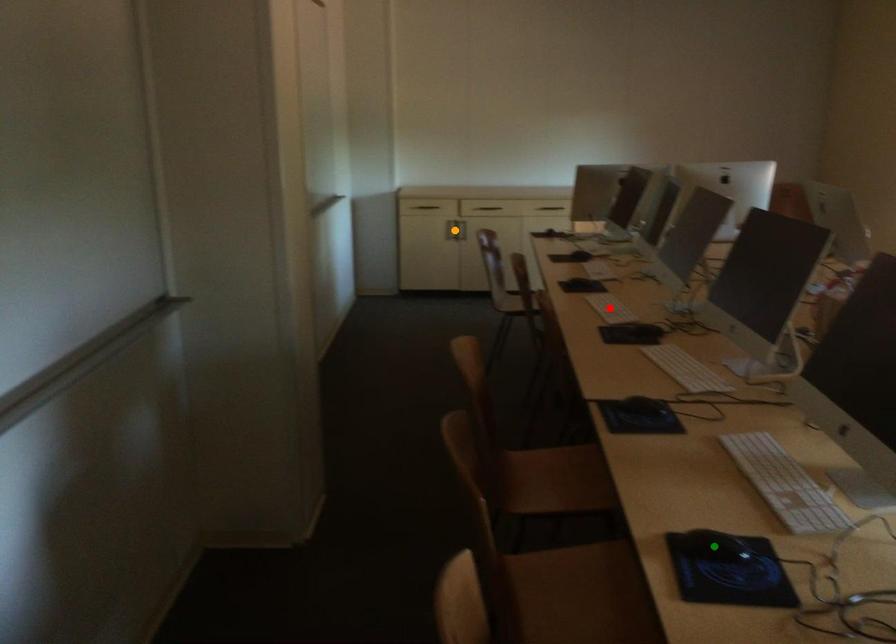
Order these from farthest to nearest:
1. red point
2. orange point
3. green point

orange point < red point < green point